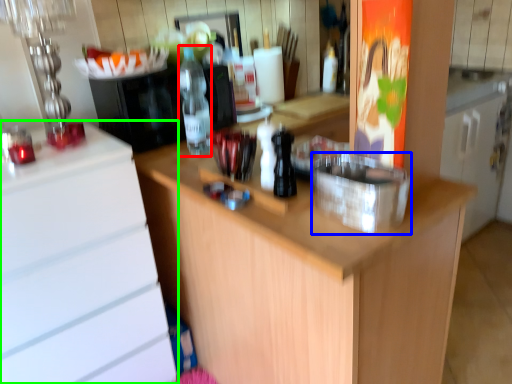
Question: Considering the real-world distances, which object is closest to bottle (highlighted by a red box)? appliance (highlighted by a blue box) or cabinetry (highlighted by a green box).

Choices:
 (A) appliance
 (B) cabinetry

Answer: (B)